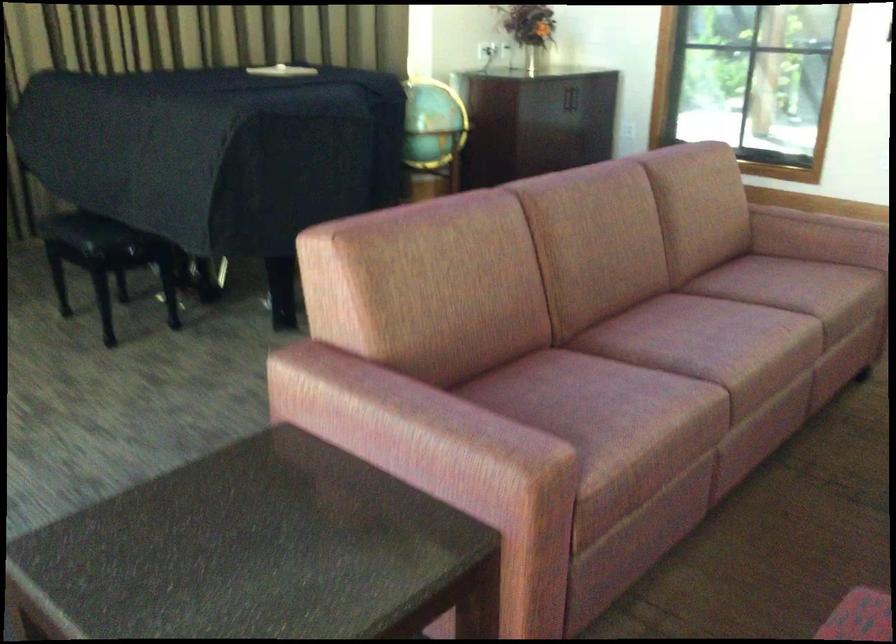
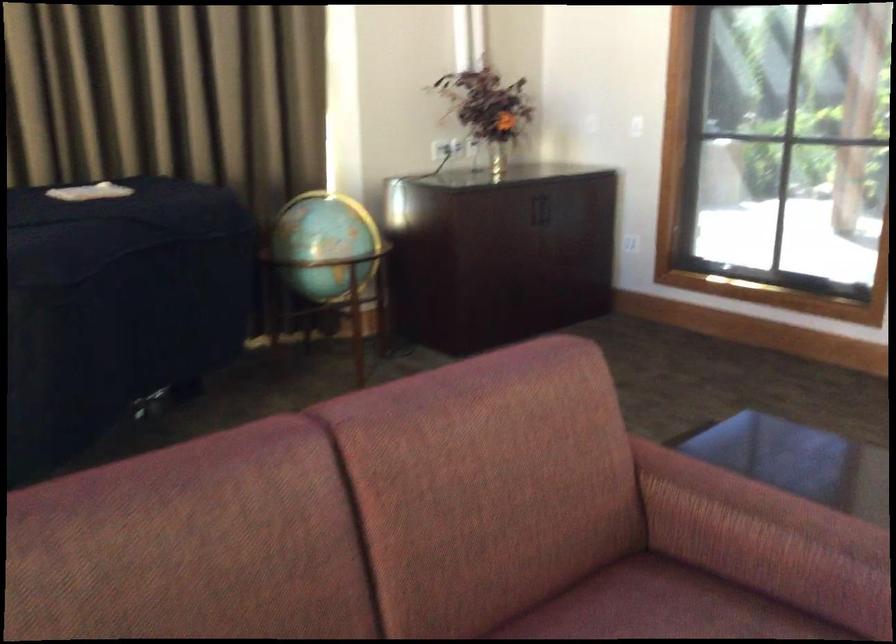
What movement of the cameraman would produce the second image?

The cameraman moved toward right, forward.